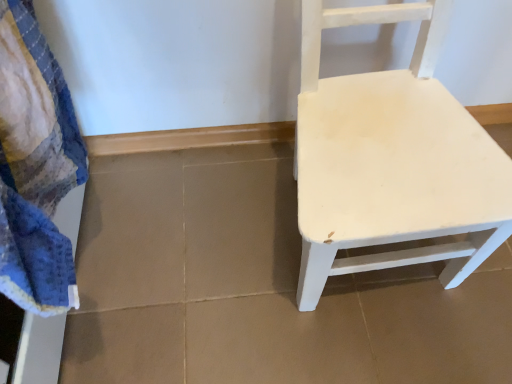
Question: Is blue textured bath towel at left oriented towards white matte chair at right?

Choices:
 (A) no
 (B) yes

Answer: (B)

Question: Does blue textured bath towel at left appear on the right side of white matte chair at right?

Choices:
 (A) yes
 (B) no

Answer: (B)

Question: Considering the relative sizes of blue textured bath towel at left and white matte chair at right in the image provided, is blue textured bath towel at left smaller than white matte chair at right?

Choices:
 (A) yes
 (B) no

Answer: (A)

Question: Can you confirm if blue textured bath towel at left is bigger than white matte chair at right?

Choices:
 (A) yes
 (B) no

Answer: (B)

Question: Is white matte chair at right surrounded by blue textured bath towel at left?

Choices:
 (A) no
 (B) yes

Answer: (A)

Question: From a real-world perspective, is blue textured bath towel at left under white matte chair at right?

Choices:
 (A) no
 (B) yes

Answer: (A)

Question: Is white matte chair at right touching blue textured bath towel at left?

Choices:
 (A) no
 (B) yes

Answer: (A)

Question: Can you confirm if white matte chair at right is bigger than blue textured bath towel at left?

Choices:
 (A) no
 (B) yes

Answer: (B)

Question: Is there a large distance between white matte chair at right and blue textured bath towel at left?

Choices:
 (A) no
 (B) yes

Answer: (A)

Question: From a real-world perspective, is white matte chair at right beneath blue textured bath towel at left?

Choices:
 (A) no
 (B) yes

Answer: (B)

Question: From the image's perspective, does white matte chair at right appear higher than blue textured bath towel at left?

Choices:
 (A) no
 (B) yes

Answer: (B)

Question: Does white matte chair at right have a smaller size compared to blue textured bath towel at left?

Choices:
 (A) no
 (B) yes

Answer: (A)

Question: Considering the positions of blue textured bath towel at left and white matte chair at right in the image, is blue textured bath towel at left wider or thinner than white matte chair at right?

Choices:
 (A) thin
 (B) wide

Answer: (A)